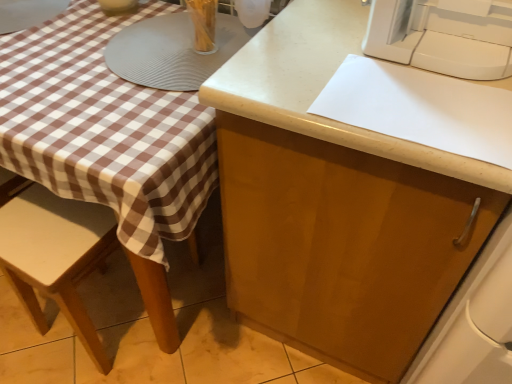
You are a GUI agent. You are given a task and a screenshot of the screen. Output one action in this format:
    pyautogui.click(x=<x>, y=<y>)
    Task: Click on the vacant space to the left of matte wood cabinet at center
    
    Given the screenshot: What is the action you would take?
    pyautogui.click(x=195, y=315)